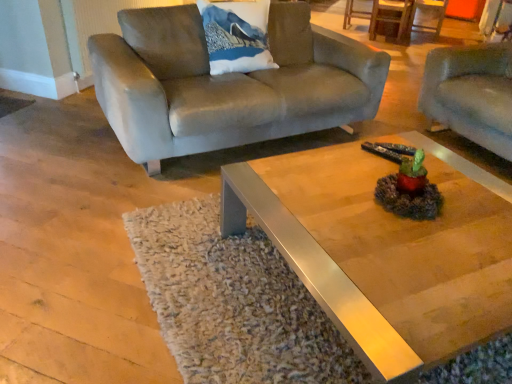
Question: In the image, is white fabric pillow with mountain print at upper center positioned in front of or behind metallic polished coffee table at center?

Choices:
 (A) front
 (B) behind

Answer: (B)

Question: From the image's perspective, relative to metallic polished coffee table at center, is white fabric pillow with mountain print at upper center above or below?

Choices:
 (A) below
 (B) above

Answer: (B)

Question: Based on their relative distances, which object is nearer to the suede-like gray couch at right, which is the 2th studio couch from left to right?

Choices:
 (A) suede couch at upper left, placed as the second studio couch when sorted from right to left
 (B) white fabric pillow with mountain print at upper center
 (C) metallic polished coffee table at center

Answer: (A)

Question: Based on their relative distances, which object is farther from the suede couch at upper left, placed as the second studio couch when sorted from right to left?

Choices:
 (A) suede-like gray couch at right, placed as the 1th studio couch when sorted from right to left
 (B) metallic polished coffee table at center
 (C) white fabric pillow with mountain print at upper center

Answer: (A)